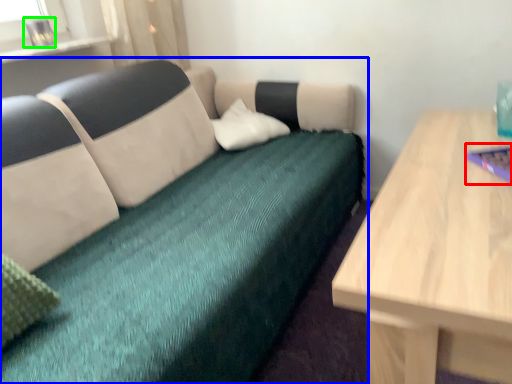
Question: Which object is positioned closest to laptop (highlighted by a red box)? Select from studio couch (highlighted by a blue box) and glass vase (highlighted by a green box).

Choices:
 (A) studio couch
 (B) glass vase

Answer: (A)